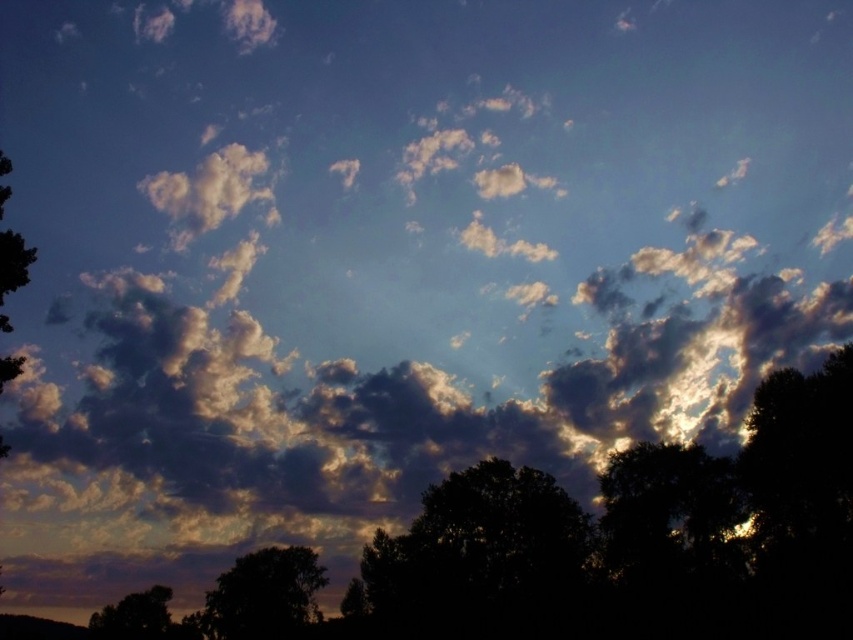
Question: Does silhouette tree at center lie behind silhouette tree at lower center?

Choices:
 (A) yes
 (B) no

Answer: (B)

Question: Is silhouette tree at center wider than silhouette tree at lower center?

Choices:
 (A) no
 (B) yes

Answer: (B)

Question: Among these objects, which one is farthest from the camera?

Choices:
 (A) dark silhouette tree at center
 (B) silhouette tree at lower left
 (C) silhouette leafy tree at left
 (D) silhouette tree at center

Answer: (B)

Question: Which of the following is the closest to the observer?

Choices:
 (A) (309, 577)
 (B) (554, 483)
 (C) (131, 595)
 (D) (570, 577)

Answer: (D)

Question: Based on their relative distances, which object is nearer to the silhouette tree at lower left?

Choices:
 (A) silhouette leafy tree at left
 (B) dark silhouette tree at center
 (C) silhouette tree at center

Answer: (C)

Question: Considering the relative positions of silhouette tree at center and dark silhouette tree at center in the image provided, where is silhouette tree at center located with respect to dark silhouette tree at center?

Choices:
 (A) left
 (B) right

Answer: (A)